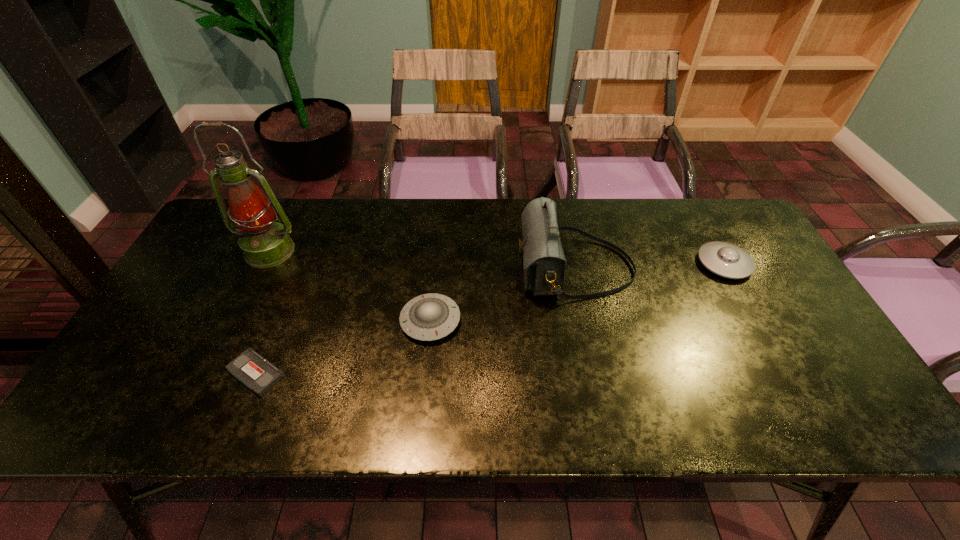
The image size is (960, 540). In order to click on free region located 0.190m on the right of the fourth shortest object in this screenshot , I will do `click(699, 268)`.

Locate an element on the screen. The width and height of the screenshot is (960, 540). vacant position located on the front of the third tallest object is located at coordinates (759, 328).

In order to click on vacant area situated 0.060m on the front of the fourth tallest object in this screenshot , I will do `click(426, 366)`.

Where is `vacant space situated on the right of the videotape`? vacant space situated on the right of the videotape is located at coordinates (436, 373).

Locate an element on the screen. This screenshot has width=960, height=540. oil lamp situated at the far edge is located at coordinates (265, 243).

Where is `shoulder bag at the far edge`? Image resolution: width=960 pixels, height=540 pixels. shoulder bag at the far edge is located at coordinates (544, 263).

You are a GUI agent. You are given a task and a screenshot of the screen. Output one action in this format:
    pyautogui.click(x=<x>, y=<y>)
    Task: Click on the saucer that is at the far edge
    
    Given the screenshot: What is the action you would take?
    pyautogui.click(x=727, y=260)

The width and height of the screenshot is (960, 540). I want to click on object that is positioned at the near edge, so click(x=253, y=370).

Locate an element on the screen. This screenshot has width=960, height=540. object present at the left edge is located at coordinates (265, 243).

Identify the location of object located at the right edge. This screenshot has width=960, height=540. tap(727, 260).